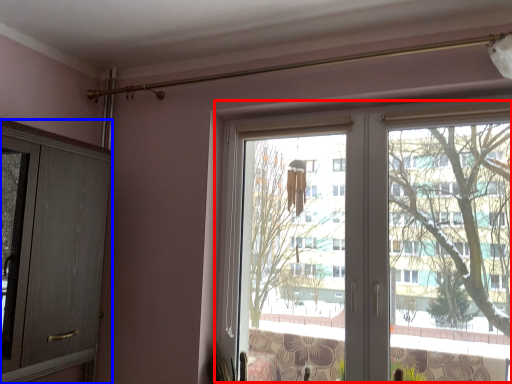
Question: Which object is closer to the camera taking this photo, bay window (highlighted by a red box) or screen door (highlighted by a blue box)?

Choices:
 (A) bay window
 (B) screen door

Answer: (B)